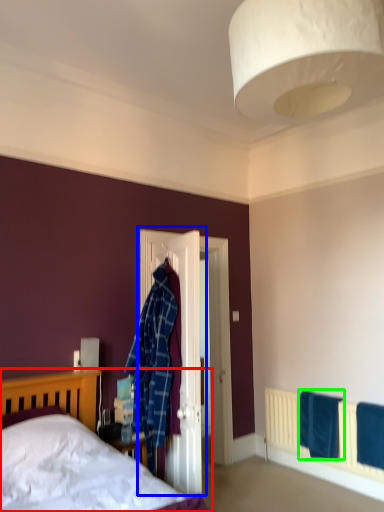
Question: Estimate the real-world distances between objects in this image. Which object is closer to bed (highlighted by a red box), door (highlighted by a blue box) or bath towel (highlighted by a green box)?

Choices:
 (A) door
 (B) bath towel

Answer: (A)